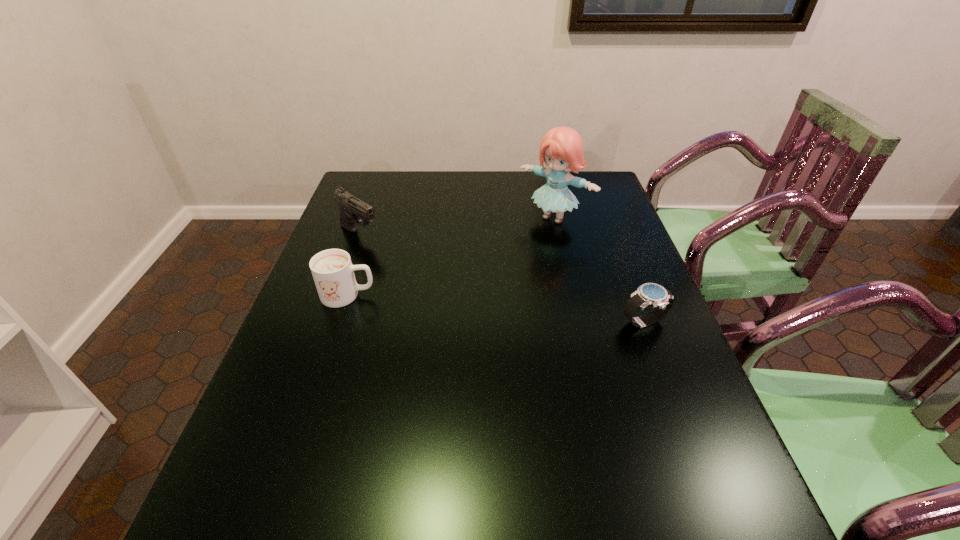
In the image, there is a desktop. Where is `free space at the left edge`? free space at the left edge is located at coordinates (375, 253).

You are a GUI agent. You are given a task and a screenshot of the screen. Output one action in this format:
    pyautogui.click(x=<x>, y=<y>)
    Task: Click on the vacant space at the right edge
    The image size is (960, 540).
    Given the screenshot: What is the action you would take?
    pyautogui.click(x=668, y=428)

Find the location of `free space at the far left corner of the desktop`. free space at the far left corner of the desktop is located at coordinates (375, 198).

This screenshot has height=540, width=960. In order to click on free space between the cappuccino and the watch in this screenshot , I will do `click(496, 309)`.

Identify the location of free spot between the cappuccino and the tallest object. (451, 256).

This screenshot has width=960, height=540. I want to click on empty space that is in between the second nearest object and the pistol, so click(354, 265).

At what (x,y) coordinates should I click in order to perform the action: click on free space between the tallest object and the second tallest object. Please return your answer as a coordinate pair (x, y). Looking at the image, I should click on (457, 226).

Locate an element on the screen. Image resolution: width=960 pixels, height=540 pixels. free area in between the cappuccino and the third shortest object is located at coordinates (354, 265).

This screenshot has height=540, width=960. Find the location of `free space that is in between the pistol and the second nearest object`. free space that is in between the pistol and the second nearest object is located at coordinates (354, 265).

Find the location of a particular element. vacant region between the cappuccino and the pistol is located at coordinates (354, 265).